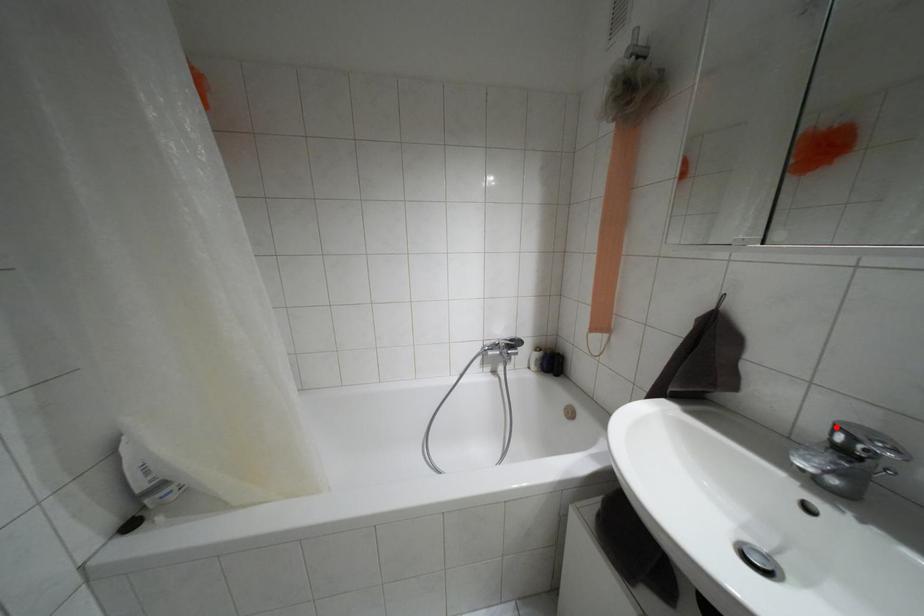
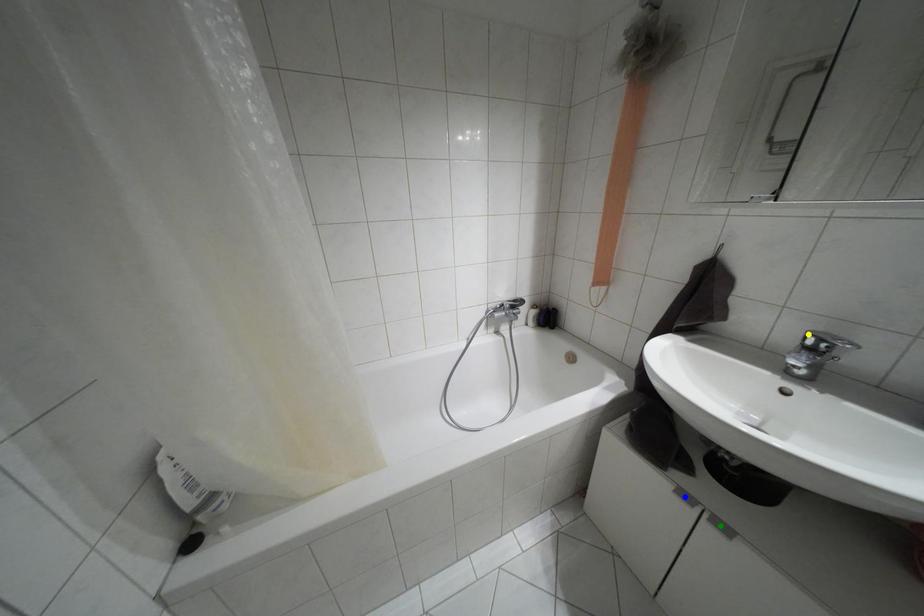
Question: I am providing you with two images of the same scene from different viewpoints. A red point is marked on the first image. You are given multiple points on the second image. Which point in image 2 represents the same 3d spot as the red point in image 1?

Choices:
 (A) yellow point
 (B) blue point
 (C) green point

Answer: (A)